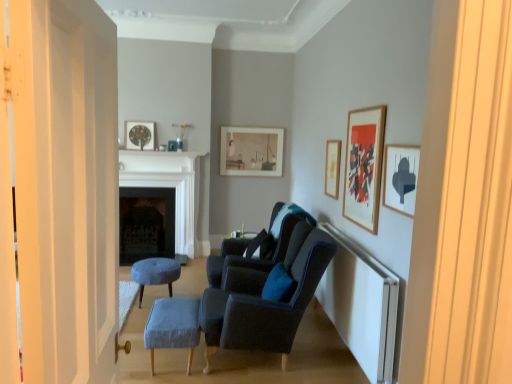
Question: Should I look upward or downward to see white marble fireplace at center, which is counted as the 2th fireplace, starting from the back?

Choices:
 (A) down
 (B) up

Answer: (A)

Question: Should I look upward or downward to see wooden framed artwork at upper right, which ranks as the 2th picture frame in front-to-back order?

Choices:
 (A) up
 (B) down

Answer: (A)

Question: Considering the relative positions of velvet blue stool at center, the 2th stool from the front, and black stone fireplace at center, which is the 1th fireplace in back-to-front order, in the image provided, is velvet blue stool at center, the 2th stool from the front, in front of black stone fireplace at center, which is the 1th fireplace in back-to-front order,?

Choices:
 (A) yes
 (B) no

Answer: (A)

Question: Could black stone fireplace at center, which is the second fireplace from front to back, be considered to be inside velvet blue stool at center, the 2th stool from the front?

Choices:
 (A) yes
 (B) no

Answer: (B)

Question: Is velvet blue stool at center, the first stool viewed from the left, aimed at black stone fireplace at center, which is the 1th fireplace in back-to-front order?

Choices:
 (A) yes
 (B) no

Answer: (B)

Question: From a real-world perspective, is velvet blue stool at center, the 2th stool viewed from the right, below black stone fireplace at center, which is the second fireplace from front to back?

Choices:
 (A) yes
 (B) no

Answer: (A)

Question: Can you confirm if velvet blue stool at center, the 2th stool viewed from the right, is positioned to the right of black stone fireplace at center, which is the 1th fireplace in back-to-front order?

Choices:
 (A) yes
 (B) no

Answer: (A)

Question: Is velvet blue stool at center, which is the first stool in back-to-front order, wider than black stone fireplace at center, which is the second fireplace from front to back?

Choices:
 (A) yes
 (B) no

Answer: (A)

Question: Would you say velvet blue stool at center, the 2th stool from the front, is outside matte black side table at center?

Choices:
 (A) yes
 (B) no

Answer: (A)

Question: From a real-world perspective, is velvet blue stool at center, the first stool viewed from the left, below matte black side table at center?

Choices:
 (A) yes
 (B) no

Answer: (A)

Question: Is velvet blue stool at center, the 2th stool from the front, facing towards matte black side table at center?

Choices:
 (A) yes
 (B) no

Answer: (B)

Question: Is velvet blue stool at center, which is the first stool in back-to-front order, wider than matte black side table at center?

Choices:
 (A) yes
 (B) no

Answer: (B)

Question: Is matte black side table at center inside velvet blue stool at center, the 2th stool from the front?

Choices:
 (A) no
 (B) yes

Answer: (A)

Question: From a real-world perspective, is velvet blue stool at center, the 2th stool from the front, located higher than matte black side table at center?

Choices:
 (A) no
 (B) yes

Answer: (A)

Question: Are matte black picture frame at upper right, the 1th picture frame when ordered from right to left, and matte black side table at center beside each other?

Choices:
 (A) no
 (B) yes

Answer: (A)